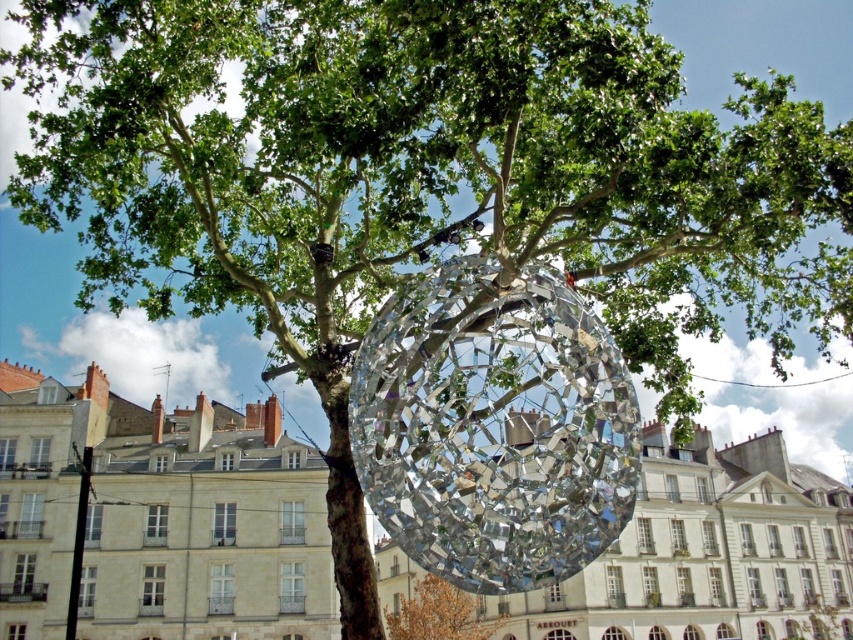
Based on the photo, you are an artist planning to paint the scene with the clear glass sphere at center and the shiny metallic sphere at center. You want to ensure the proportions between them are accurate. Which sphere should you paint as wider?

The clear glass sphere at center should be painted as wider since its width is larger than the shiny metallic sphere at center.

You are standing in the urban scene and want to locate the clear glass sphere at center. According to the coordinates provided, where should you look relative to the large tree with lush green foliage?

The clear glass sphere at center is located at coordinates 0.809 on the x axis and 0.188 on the y axis, which means it is positioned to the right and slightly above the large tree with lush green foliage.